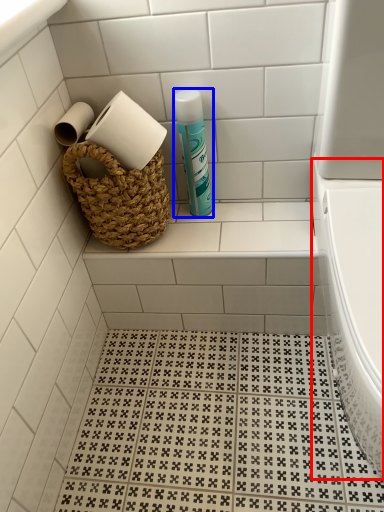
Question: Which of the following is the closest to the observer, bath (highlighted by a red box) or cleaning product (highlighted by a blue box)?

Choices:
 (A) bath
 (B) cleaning product

Answer: (A)